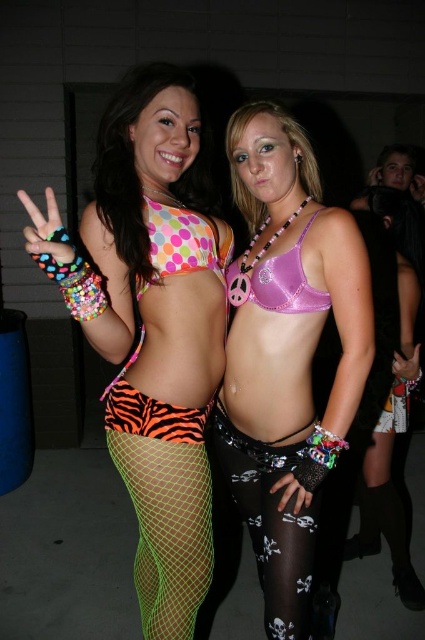
Question: Which of the following is the closest to the observer?

Choices:
 (A) tiger print fabric at lower center
 (B) neon green mesh tights at lower left

Answer: (B)

Question: Does neon polka dot bikini top at center appear on the right side of neon green mesh tights at lower left?

Choices:
 (A) yes
 (B) no

Answer: (B)

Question: Which object is positioned closest to the neon polka dot bikini top at center?

Choices:
 (A) pink shiny bra at center
 (B) neon green mesh tights at lower left
 (C) black mesh tights at lower center

Answer: (B)

Question: Estimate the real-world distances between objects in this image. Which object is closer to the neon green mesh tights at lower left?

Choices:
 (A) tiger print fabric at lower center
 (B) black mesh tights at lower center
 (C) purple satin bikini top at center
 (D) neon polka dot bikini top at center

Answer: (D)

Question: Does black mesh tights at lower center have a smaller size compared to purple satin bikini top at center?

Choices:
 (A) no
 (B) yes

Answer: (A)

Question: Is neon green mesh tights at lower left further to camera compared to black mesh tights at lower center?

Choices:
 (A) yes
 (B) no

Answer: (A)